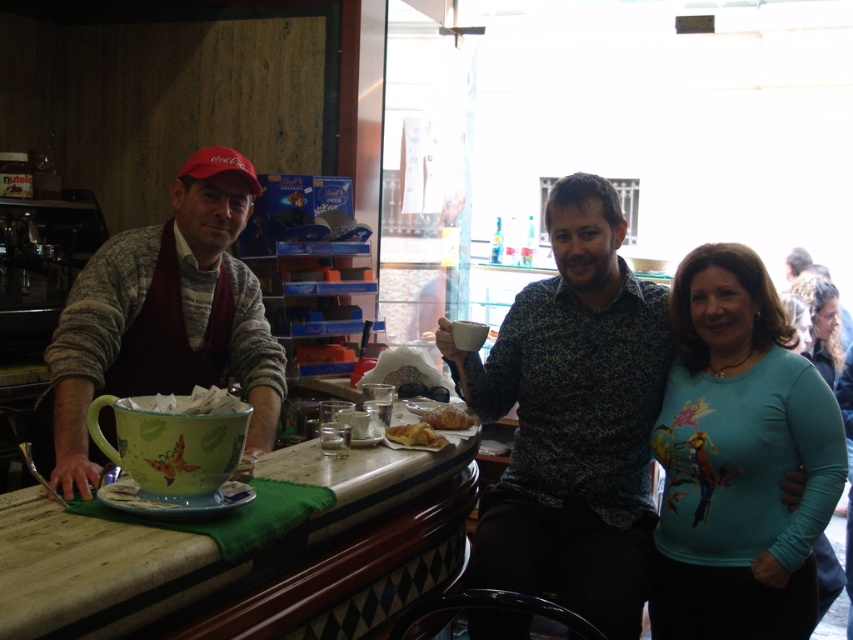
Does green fabric-covered table at center have a lesser height compared to golden crispy pastry at center?

Incorrect, green fabric-covered table at center's height does not fall short of golden crispy pastry at center's.

Who is more distant from viewer, (367, 513) or (426, 410)?

The point (426, 410) is more distant.

Where is `green fabric-covered table at center`? This screenshot has width=853, height=640. green fabric-covered table at center is located at coordinates pyautogui.click(x=180, y=545).

Is point (726, 362) farther from camera compared to point (434, 419)?

No, (726, 362) is in front of (434, 419).

The height and width of the screenshot is (640, 853). What are the coordinates of `teal matte shirt at center` in the screenshot? It's located at (738, 460).

Where is `teal matte shirt at center`? teal matte shirt at center is located at coordinates (738, 460).

Can you confirm if green fabric-covered table at center is positioned above golden flaky pastry at center?

No, green fabric-covered table at center is not above golden flaky pastry at center.

Between point (55, 531) and point (437, 442), which one is positioned in front?

Positioned in front is point (55, 531).

Is point (49, 563) positioned before point (393, 432)?

Yes, it is.

Identify the location of green fabric-covered table at center. This screenshot has height=640, width=853. (180, 545).